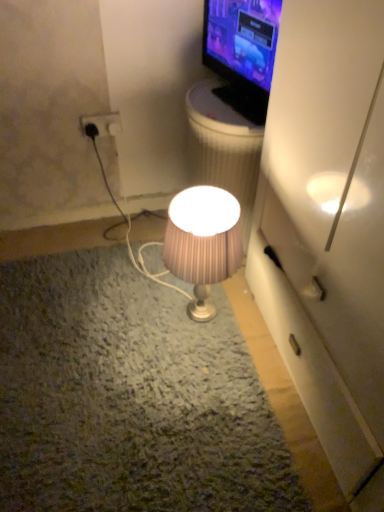
Question: From a real-world perspective, is pink pleated fabric lampshade at center below black plastic power outlet at upper left?

Choices:
 (A) no
 (B) yes

Answer: (B)

Question: Is pink pleated fabric lampshade at center turned away from black plastic power outlet at upper left?

Choices:
 (A) no
 (B) yes

Answer: (A)

Question: Does pink pleated fabric lampshade at center turn towards black plastic power outlet at upper left?

Choices:
 (A) no
 (B) yes

Answer: (A)

Question: Is pink pleated fabric lampshade at center bigger than black plastic power outlet at upper left?

Choices:
 (A) yes
 (B) no

Answer: (A)

Question: Is pink pleated fabric lampshade at center placed right next to black plastic power outlet at upper left?

Choices:
 (A) no
 (B) yes

Answer: (A)

Question: In terms of height, does black plastic power outlet at upper left look taller or shorter compared to white plastic trash bin/can at upper center?

Choices:
 (A) short
 (B) tall

Answer: (A)

Question: From the image's perspective, is black plastic power outlet at upper left positioned above or below white plastic trash bin/can at upper center?

Choices:
 (A) above
 (B) below

Answer: (A)

Question: Is black plastic power outlet at upper left in front of or behind white plastic trash bin/can at upper center in the image?

Choices:
 (A) behind
 (B) front

Answer: (A)

Question: Is black plastic power outlet at upper left situated inside white plastic trash bin/can at upper center or outside?

Choices:
 (A) inside
 (B) outside

Answer: (B)

Question: From the image's perspective, relative to matte black tv at upper right, is white plastic trash bin/can at upper center above or below?

Choices:
 (A) below
 (B) above

Answer: (A)

Question: From a real-world perspective, relative to matte black tv at upper right, is white plastic trash bin/can at upper center vertically above or below?

Choices:
 (A) below
 (B) above

Answer: (A)

Question: Is white plastic trash bin/can at upper center inside the boundaries of matte black tv at upper right, or outside?

Choices:
 (A) inside
 (B) outside

Answer: (B)

Question: In the image, is white plastic trash bin/can at upper center positioned in front of or behind matte black tv at upper right?

Choices:
 (A) behind
 (B) front

Answer: (A)

Question: Does point (266, 76) appear closer or farther from the camera than point (248, 131)?

Choices:
 (A) farther
 (B) closer

Answer: (B)

Question: Relative to white plastic trash bin/can at upper center, is matte black tv at upper right in front or behind?

Choices:
 (A) front
 (B) behind

Answer: (A)